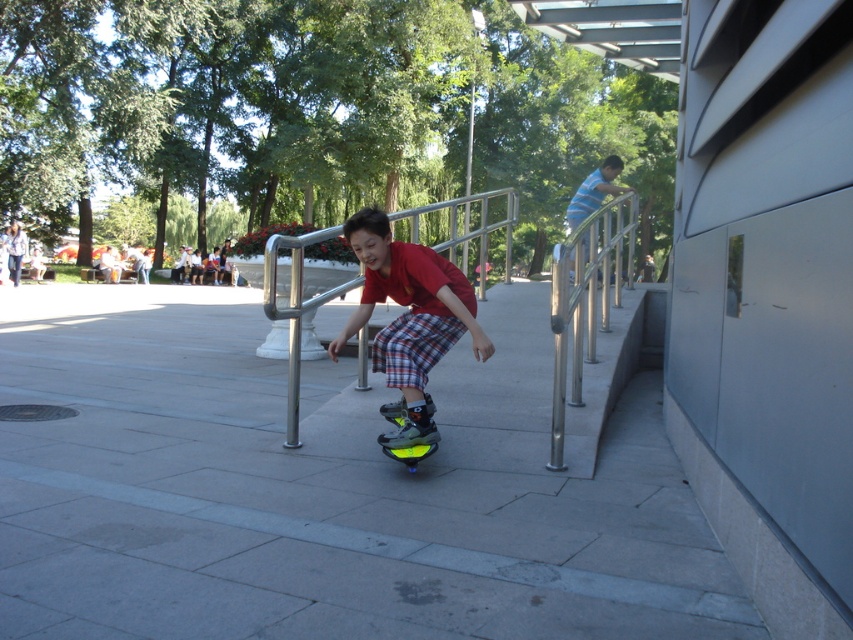
Question: Which object is the closest to the gray concrete pavement at center?

Choices:
 (A) matte red shirt at center
 (B) neon yellow plastic skateboard at center

Answer: (A)

Question: Can you confirm if gray concrete pavement at center is positioned above matte red shirt at center?

Choices:
 (A) no
 (B) yes

Answer: (B)

Question: Does matte red shirt at center appear under neon yellow plastic skateboard at center?

Choices:
 (A) no
 (B) yes

Answer: (A)

Question: Estimate the real-world distances between objects in this image. Which object is closer to the matte red shirt at center?

Choices:
 (A) neon yellow plastic skateboard at center
 (B) gray concrete pavement at center

Answer: (A)

Question: Which point appears closest to the camera in this image?

Choices:
 (A) (28, 346)
 (B) (396, 413)

Answer: (B)

Question: Is matte red shirt at center bigger than neon yellow plastic skateboard at center?

Choices:
 (A) no
 (B) yes

Answer: (B)